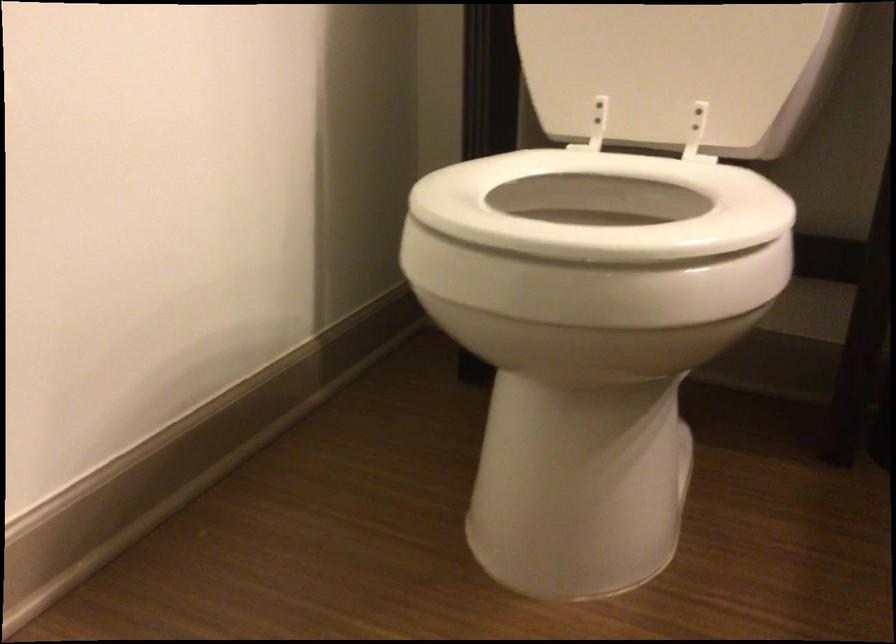
Find the location of a particular element. white toilet lid is located at coordinates (677, 71).